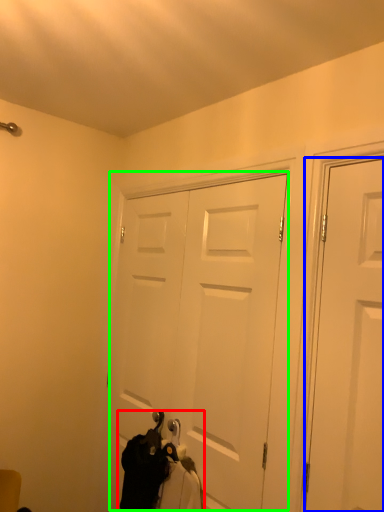
Question: Which object is positioned farthest from laundry (highlighted by a red box)? Select from door (highlighted by a blue box) and door (highlighted by a green box).

Choices:
 (A) door
 (B) door

Answer: (A)